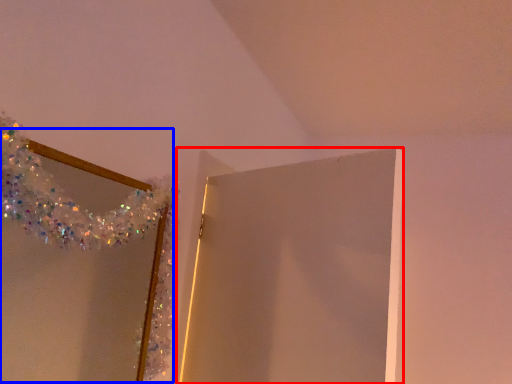
Question: Which object is further to the camera taking this photo, door (highlighted by a red box) or mirror (highlighted by a blue box)?

Choices:
 (A) door
 (B) mirror

Answer: (A)